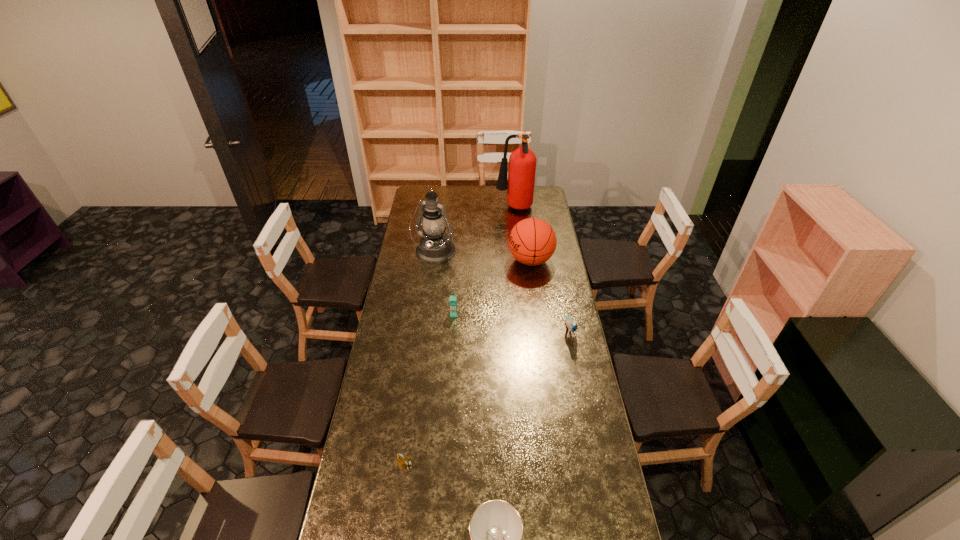
The image size is (960, 540). I want to click on fire extinguisher, so click(x=522, y=162).

In order to click on the farthest object in this screenshot , I will do `click(522, 162)`.

Identify the location of oil lamp. The height and width of the screenshot is (540, 960). (435, 247).

Find the location of `basketball`. basketball is located at coordinates (532, 241).

Find the location of a particular element. cellular telephone is located at coordinates (453, 299).

Locate an element on the screen. The width and height of the screenshot is (960, 540). bird is located at coordinates (572, 324).

Find the location of a particular element. The width and height of the screenshot is (960, 540). padlock is located at coordinates (401, 460).

The width and height of the screenshot is (960, 540). Identify the location of free space located at the nozzle of the farthest object. click(454, 208).

Locate an element on the screen. vacant space located at the nozzle of the farthest object is located at coordinates (480, 208).

I want to click on free space located 0.150m at the nozzle of the farthest object, so click(x=471, y=208).